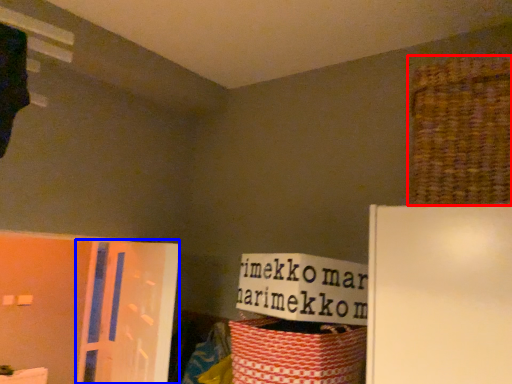
Question: Which point is closer to the camera, basket (highlighted by a red box) or screen door (highlighted by a blue box)?

Choices:
 (A) basket
 (B) screen door

Answer: (A)